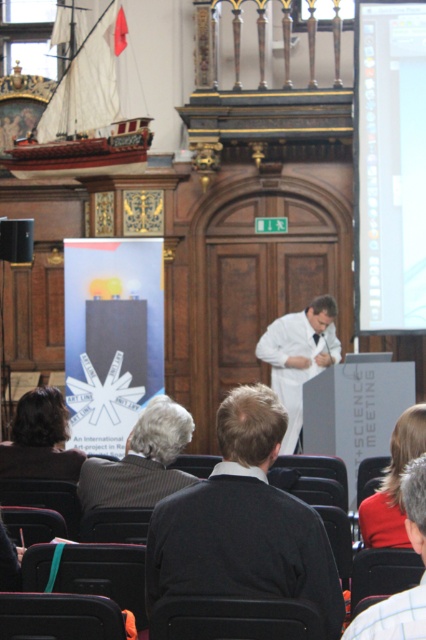
Question: Estimate the real-world distances between objects in this image. Which object is farther from the wooden ship at upper left?

Choices:
 (A) white shirt at center
 (B) dark brown hair at lower left

Answer: (A)

Question: Is wooden ship at upper left positioned in front of gray woolen sweater at lower left?

Choices:
 (A) no
 (B) yes

Answer: (A)

Question: Which object is positioned closest to the red fabric coat at lower right?

Choices:
 (A) white smooth coat at center
 (B) gray woolen sweater at lower left
 (C) dark gray sweater at center

Answer: (C)

Question: From the image, what is the correct spatial relationship of white glossy projector screen at upper right in relation to white shirt at center?

Choices:
 (A) left
 (B) right

Answer: (B)

Question: Among these objects, which one is nearest to the camera?

Choices:
 (A) dark gray sweater at center
 (B) dark brown hair at lower left
 (C) gray woolen sweater at lower left
 (D) red fabric coat at lower right

Answer: (A)

Question: Is wooden ship at upper left below white smooth coat at center?

Choices:
 (A) yes
 (B) no

Answer: (B)